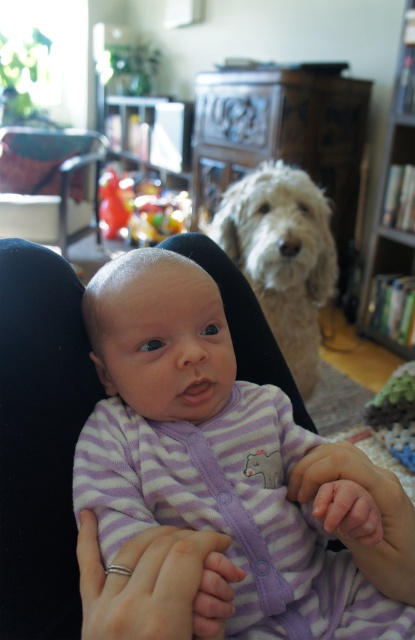
Based on the photo, can you confirm if purple striped onesie at center is thinner than wooden bookshelf at right?

No.

Is point (134, 332) farther from viewer compared to point (397, 93)?

No, it is in front of (397, 93).

Where is `purple striped onesie at center`? purple striped onesie at center is located at coordinates (221, 460).

Between point (131, 392) and point (268, 193), which one is positioned behind?

The point (268, 193) is behind.

Which is more to the left, purple striped onesie at center or white fluffy dog at upper center?

From the viewer's perspective, purple striped onesie at center appears more on the left side.

Between point (322, 604) and point (237, 184), which one is positioned behind?

The point (237, 184) is more distant.

This screenshot has height=640, width=415. I want to click on purple striped onesie at center, so click(x=221, y=460).

The width and height of the screenshot is (415, 640). I want to click on white fluffy dog at upper center, so click(283, 257).

Does white fluffy dog at upper center have a greater height compared to wooden bookshelf at right?

In fact, white fluffy dog at upper center may be shorter than wooden bookshelf at right.

At what (x,y) coordinates should I click in order to perform the action: click on white fluffy dog at upper center. Please return your answer as a coordinate pair (x, y). Looking at the image, I should click on (283, 257).

Locate an element on the screen. The width and height of the screenshot is (415, 640). white fluffy dog at upper center is located at coordinates (283, 257).